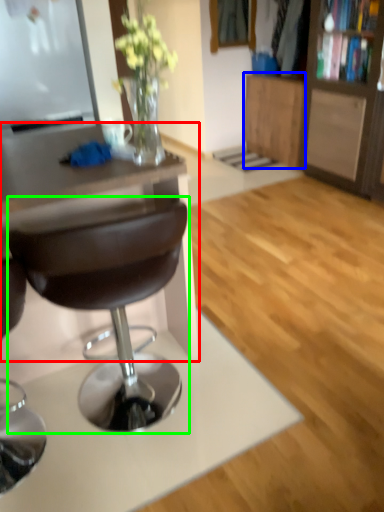
Question: Which object is the farthest from desk (highlighted by a red box)? Choose among these: cabinetry (highlighted by a blue box) or chair (highlighted by a green box).

Choices:
 (A) cabinetry
 (B) chair

Answer: (A)